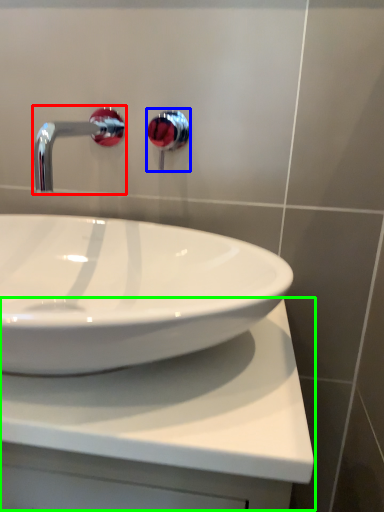
Question: Which is farther away from tap (highlighted by a red box)? plumbing fixture (highlighted by a blue box) or counter top (highlighted by a green box)?

Choices:
 (A) plumbing fixture
 (B) counter top

Answer: (A)